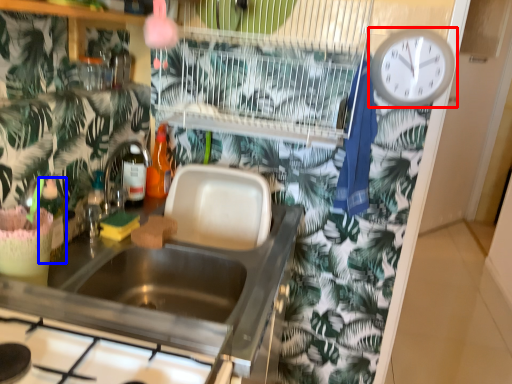
Question: Among these objects, which one is nearest to the camera, wall clock (highlighted by a red box) or bottle (highlighted by a blue box)?

Choices:
 (A) wall clock
 (B) bottle

Answer: (B)